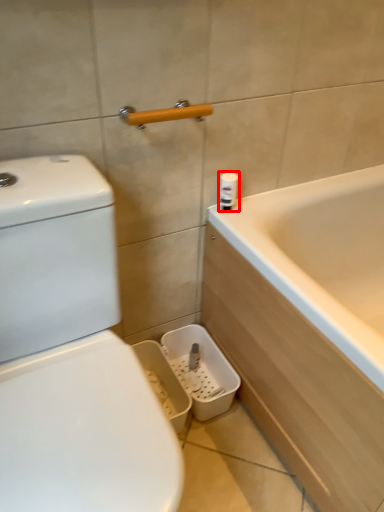
Question: From the image's perspective, what is the correct spatial positioning of toiletry (annotated by the red box) in reference to towel bar?

Choices:
 (A) below
 (B) above

Answer: (A)